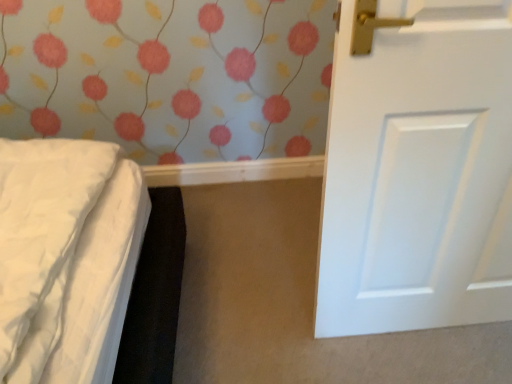
I want to click on free space in front of white matte door at right, so click(433, 358).